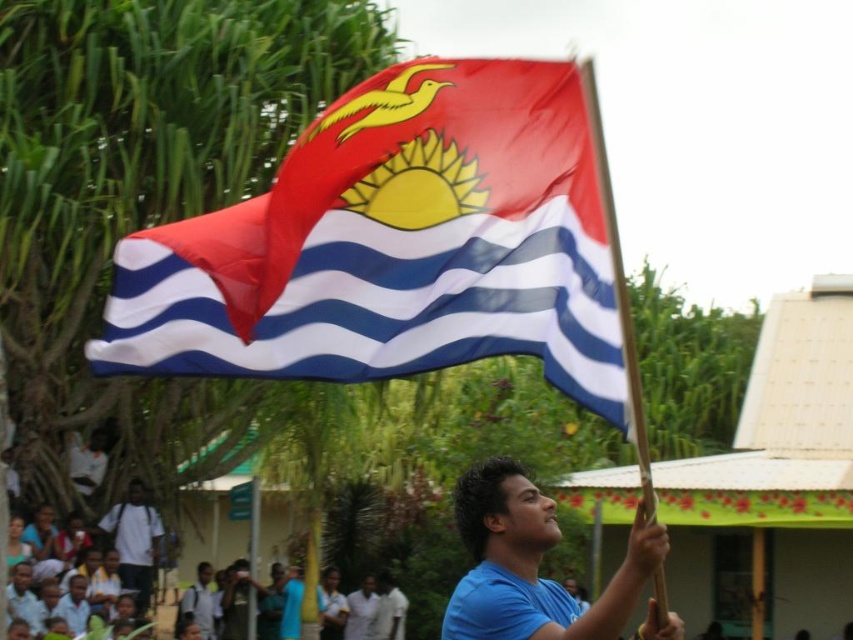
Who is taller, blue matte shirt at center or white cotton shirt at lower left?

blue matte shirt at center

Is blue matte shirt at center bigger than white cotton shirt at lower left?

Indeed, blue matte shirt at center has a larger size compared to white cotton shirt at lower left.

Between point (508, 552) and point (137, 548), which one is positioned behind?

Point (137, 548)

Identify the location of blue matte shirt at center. Image resolution: width=853 pixels, height=640 pixels. (532, 564).

Is silky fabric flag at center taller than blue matte shirt at center?

Yes, silky fabric flag at center is taller than blue matte shirt at center.

Is point (549, 266) positioned after point (596, 605)?

No, (549, 266) is closer to viewer.

I want to click on silky fabric flag at center, so click(x=396, y=244).

Between silky fabric flag at center and white cotton shirt at lower left, which one has less height?

Standing shorter between the two is white cotton shirt at lower left.

In the scene shown: Can you confirm if silky fabric flag at center is positioned below white cotton shirt at lower left?

No.

Where is `silky fabric flag at center`? silky fabric flag at center is located at coordinates (396, 244).

Locate an element on the screen. silky fabric flag at center is located at coordinates (396, 244).